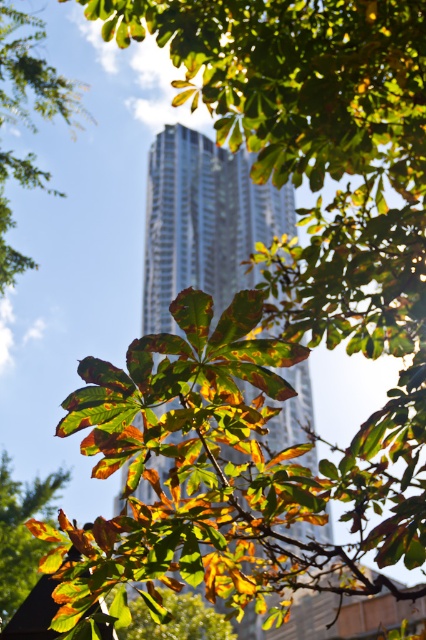
You are standing in a park and see the silver metallic tower at center and the leaves at center. Which object is located to the right of the other?

The silver metallic tower at center is positioned on the right side of leaves at center, so the silver metallic tower at center is to the right of the leaves at center.

You are standing in a park and see the silver metallic tower at center. If you have a 2.0 meter long ladder, can you place it against the tower to reach the top?

The silver metallic tower at center is 2.18 meters away from viewer. Since the ladder is only 2.0 meters long, it is not long enough to reach the tower from your current position.